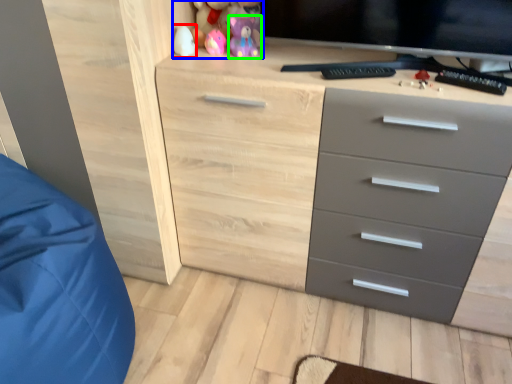
Question: Based on their relative distances, which object is farther from toy (highlighted by a red box)? Choose from toy (highlighted by a blue box) and toy (highlighted by a green box).

Choices:
 (A) toy
 (B) toy

Answer: (B)